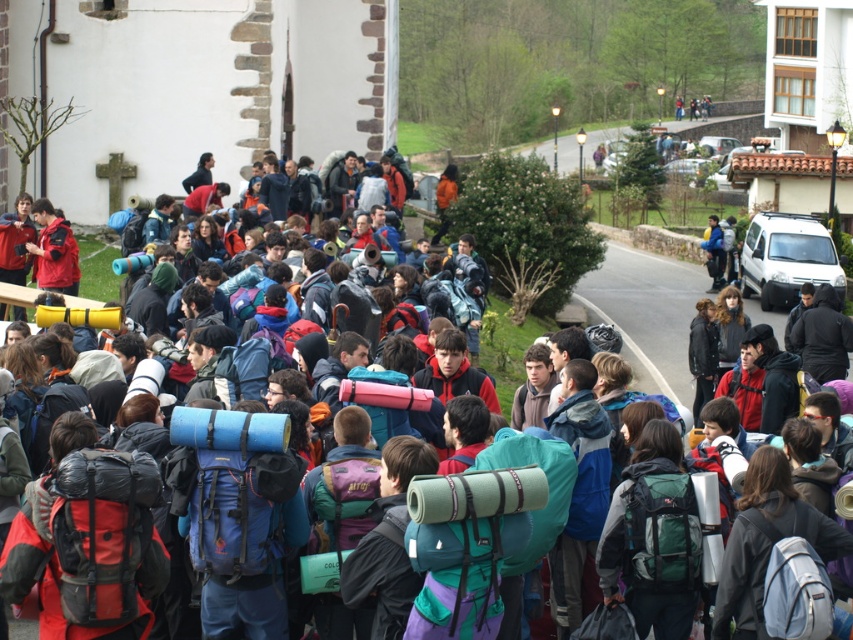
Is red fabric backpack at center bigger than blue fabric backpack at center?

No, red fabric backpack at center is not bigger than blue fabric backpack at center.

Is point (68, 506) positioned behind point (277, 513)?

No, (68, 506) is closer to viewer.

Between point (96, 476) and point (223, 490), which one is positioned in front?

Positioned in front is point (96, 476).

You are a GUI agent. You are given a task and a screenshot of the screen. Output one action in this format:
    pyautogui.click(x=<x>, y=<y>)
    Task: Click on the red fabric backpack at center
    The image size is (853, 640).
    Given the screenshot: What is the action you would take?
    pyautogui.click(x=106, y=536)

Between blue fabric backpack at center and green fabric backpack at center, which one appears on the left side from the viewer's perspective?

blue fabric backpack at center is more to the left.

Between blue fabric backpack at center and green fabric backpack at center, which one has less height?

With less height is green fabric backpack at center.

Does point (186, 524) come in front of point (646, 493)?

Yes, it is in front of point (646, 493).

The height and width of the screenshot is (640, 853). In order to click on blue fabric backpack at center in this screenshot , I will do `click(238, 492)`.

Which of these two, red fabric backpack at center or light blue fabric backpack at center, stands taller?

red fabric backpack at center

How distant is red fabric backpack at center from light blue fabric backpack at center?

The distance of red fabric backpack at center from light blue fabric backpack at center is 9.93 meters.

Which is in front, point (158, 593) or point (763, 516)?

Point (158, 593) is more forward.

You are a GUI agent. You are given a task and a screenshot of the screen. Output one action in this format:
    pyautogui.click(x=<x>, y=<y>)
    Task: Click on the red fabric backpack at center
    
    Given the screenshot: What is the action you would take?
    pyautogui.click(x=106, y=536)